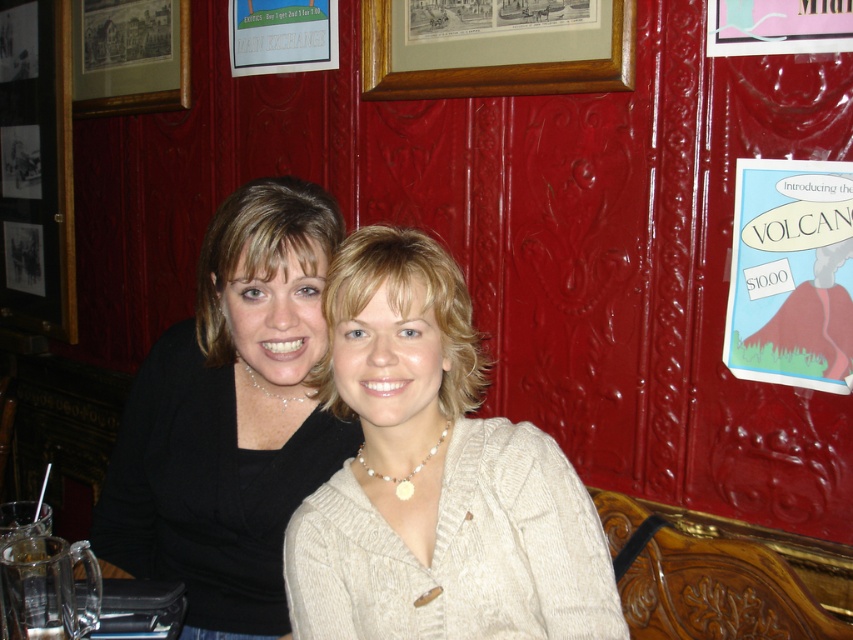
You are a painter who needs to hang a 1.5 meter wide canvas on the wall. You see the matte black sweater at center and the wooden framed print at upper left. Which object is closer to where you want to hang the canvas if the canvas will be placed exactly halfway between them?

The wooden framed print at upper left is closer to the canvas placement point because the distance between the matte black sweater at center and wooden framed print at upper left is 1.58 meters. Halfway would be 0.79 meters from each, so whichever object is closer to the midpoint. Wait, but the question is which is closer to the canvas placement point, which is halfway between them. Since the distance between them is 1.58 meters, the midpoint is equidistant from both. Hmm, maybe the question is flawed. Wait

You are a tailor measuring fabrics for alterations. You have a piece of fabric that is exactly the same width as the wooden frame at upper center. Can you use this fabric to cover the matte black sweater at center without any adjustments?

The matte black sweater at center has a width less than the wooden frame at upper center. Since the fabric matches the frame width, it will be wider than needed for the sweater. You can use it without adjustments, as the fabric is wider than the sweater.